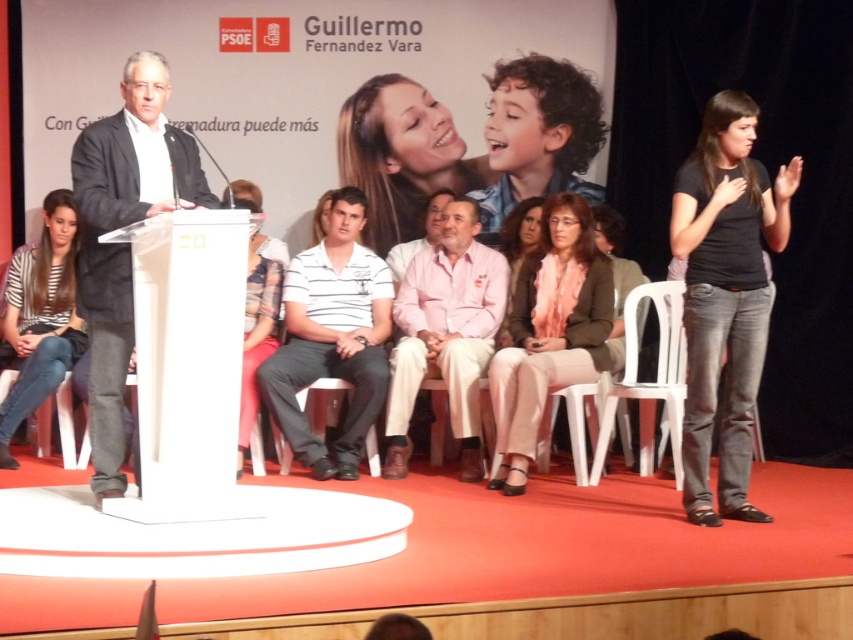
You are a photographer positioned at the front of the stage. You need to capture a closeup shot of the light beige pants at center. Based on the coordinates provided, where should you aim your camera?

The light beige pants at center is located at point (549,332), so aim your camera at those coordinates to capture the closeup.